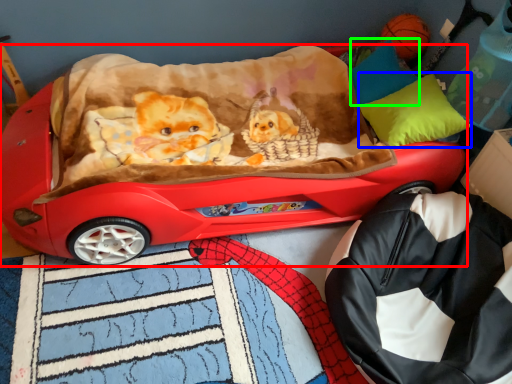
Question: Estimate the real-world distances between objects in this image. Which object is farther from car (highlighted by a red box), pillow (highlighted by a blue box) or pillow (highlighted by a green box)?

Choices:
 (A) pillow
 (B) pillow

Answer: (B)